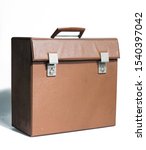
Find the location of a particular element. The image size is (146, 150). latch 2 is located at coordinates (104, 66).